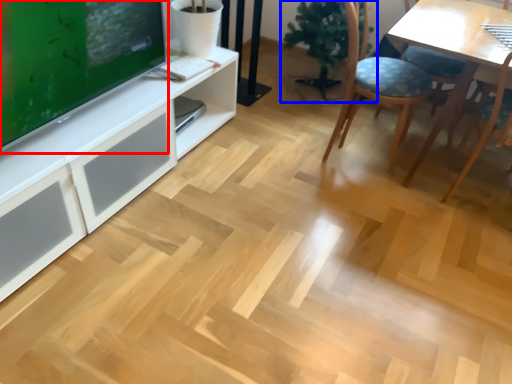
Question: Which object is further to the camera taking this photo, television (highlighted by a red box) or houseplant (highlighted by a blue box)?

Choices:
 (A) television
 (B) houseplant

Answer: (B)